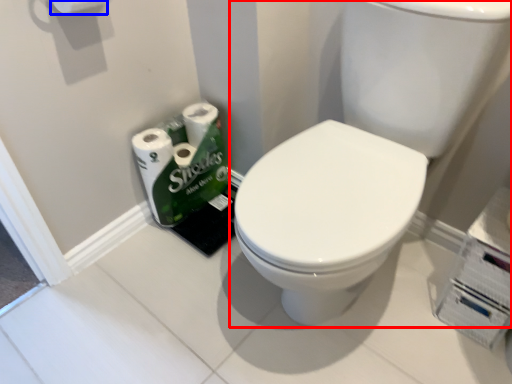
Question: Which point is further to the camera, sink (highlighted by a red box) or toilet paper (highlighted by a blue box)?

Choices:
 (A) sink
 (B) toilet paper

Answer: (B)